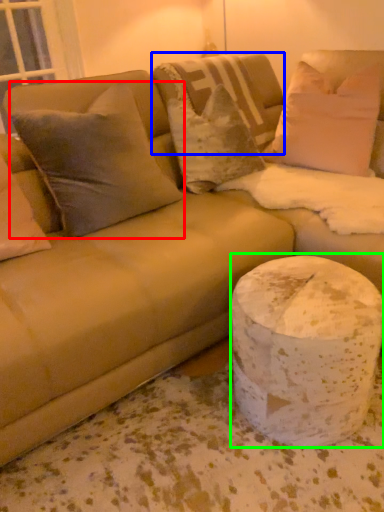
Question: Which object is positioned closest to pillow (highlighted by a red box)? Select from pillow (highlighted by a blue box) and marble (highlighted by a green box).

Choices:
 (A) pillow
 (B) marble

Answer: (A)